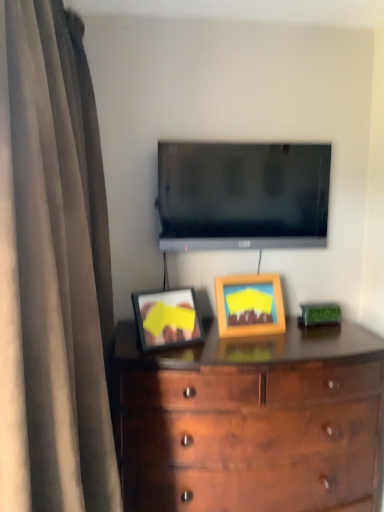
Question: Would you say flat screen tv at upper center is outside brown fabric curtain at left?

Choices:
 (A) no
 (B) yes

Answer: (B)

Question: Is flat screen tv at upper center positioned before brown fabric curtain at left?

Choices:
 (A) yes
 (B) no

Answer: (B)

Question: Can you confirm if flat screen tv at upper center is shorter than brown fabric curtain at left?

Choices:
 (A) yes
 (B) no

Answer: (A)

Question: From the image's perspective, would you say flat screen tv at upper center is positioned over brown fabric curtain at left?

Choices:
 (A) no
 (B) yes

Answer: (B)

Question: Does flat screen tv at upper center contain brown fabric curtain at left?

Choices:
 (A) no
 (B) yes

Answer: (A)

Question: Considering the positions of wooden picture frame at center and brown fabric curtain at left in the image, is wooden picture frame at center bigger or smaller than brown fabric curtain at left?

Choices:
 (A) big
 (B) small

Answer: (B)

Question: From a real-world perspective, relative to brown fabric curtain at left, is wooden picture frame at center vertically above or below?

Choices:
 (A) above
 (B) below

Answer: (B)

Question: Looking at their shapes, would you say wooden picture frame at center is wider or thinner than brown fabric curtain at left?

Choices:
 (A) wide
 (B) thin

Answer: (B)

Question: Would you say wooden picture frame at center is to the left or to the right of brown fabric curtain at left in the picture?

Choices:
 (A) left
 (B) right

Answer: (B)

Question: In terms of height, does wooden picture frame at center look taller or shorter compared to flat screen tv at upper center?

Choices:
 (A) short
 (B) tall

Answer: (A)

Question: Is wooden picture frame at center in front of or behind flat screen tv at upper center in the image?

Choices:
 (A) front
 (B) behind

Answer: (A)

Question: In terms of size, does wooden picture frame at center appear bigger or smaller than flat screen tv at upper center?

Choices:
 (A) big
 (B) small

Answer: (B)

Question: From a real-world perspective, is wooden picture frame at center positioned above or below flat screen tv at upper center?

Choices:
 (A) above
 (B) below

Answer: (B)

Question: From the image's perspective, relative to wooden picture frame at center, is brown fabric curtain at left above or below?

Choices:
 (A) above
 (B) below

Answer: (B)

Question: Is point (31, 364) closer or farther from the camera than point (261, 306)?

Choices:
 (A) closer
 (B) farther

Answer: (A)